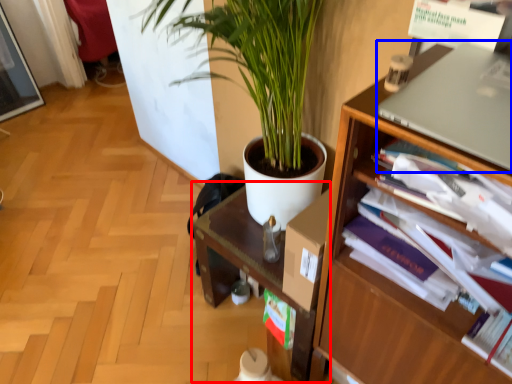
Question: Which object appears closest to the camera in this image, computer desk (highlighted by a red box) or computer (highlighted by a blue box)?

Choices:
 (A) computer desk
 (B) computer

Answer: (B)